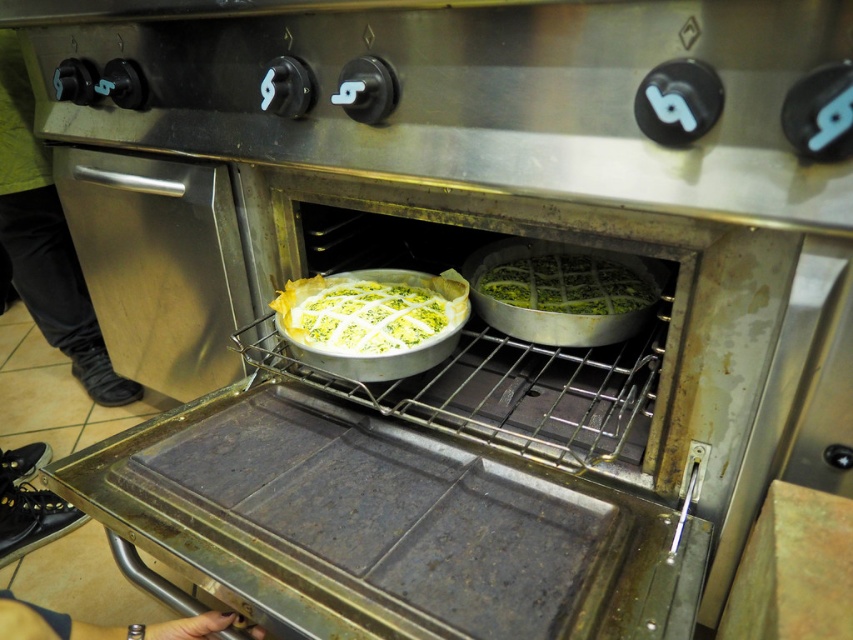
You are a chef preparing to place a new dish in the oven. You have a new dish that is the same size as the black leather shoe at lower left. Can the green matte pie at center fit in the oven along with the new dish?

The green matte pie at center is larger in size than the black leather shoe at lower left. Since the new dish is the same size as the black leather shoe, the green matte pie may not fit alongside it due to its larger size.

You are a chef preparing to place both the green matte pie at center and the black leather shoe at lower left into the oven. The oven has a maximum width capacity of 30 cm. According to the objects description, can both items fit side by side inside the oven?

The green matte pie at center might be wider than black leather shoe at lower left, so it is uncertain if both items can fit side by side in the oven since their combined width may exceed the oven s 30 cm capacity.

You are a chef trying to reach the control panel of the oven. You notice two points inside the oven, point (608, 301) and point (61, 628). Which point is closer to you?

Point (608, 301) is further to the viewer than point (61, 628), so the point closer to you is point (61, 628).